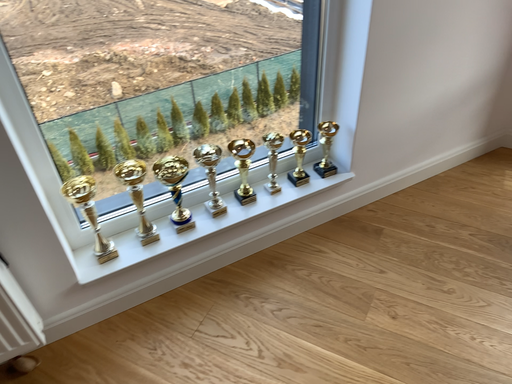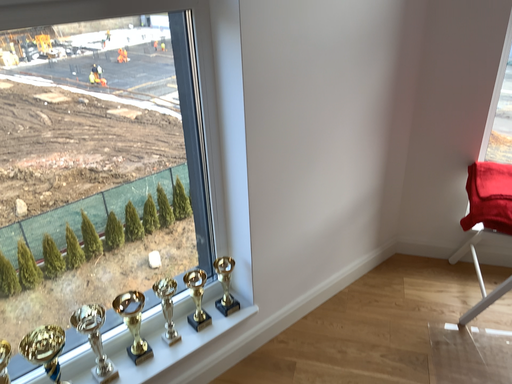
Question: Which way did the camera rotate in the video?

Choices:
 (A) rotated downward
 (B) rotated upward

Answer: (B)